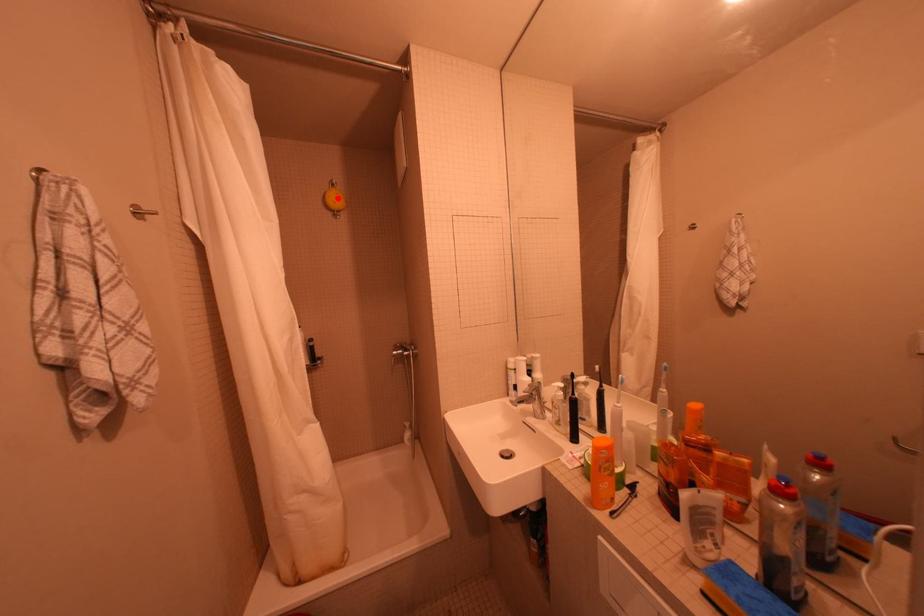
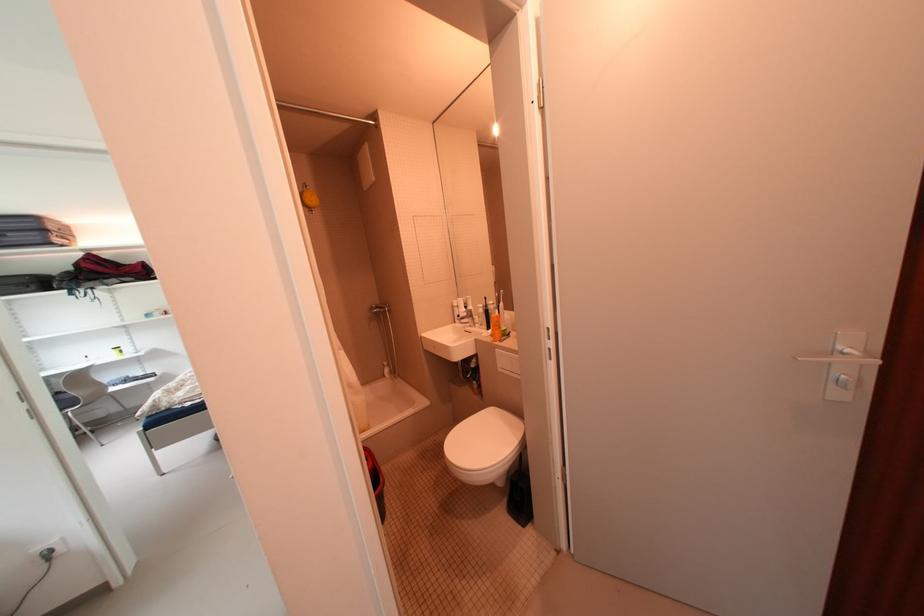
The point at the highlighted location is marked in the first image. Where is the corresponding point in the second image?

(314, 198)